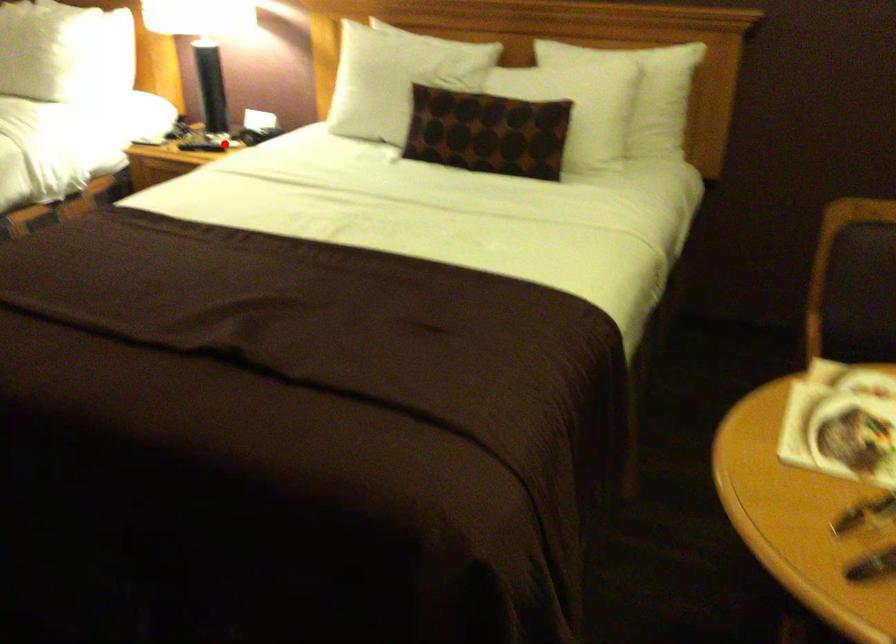
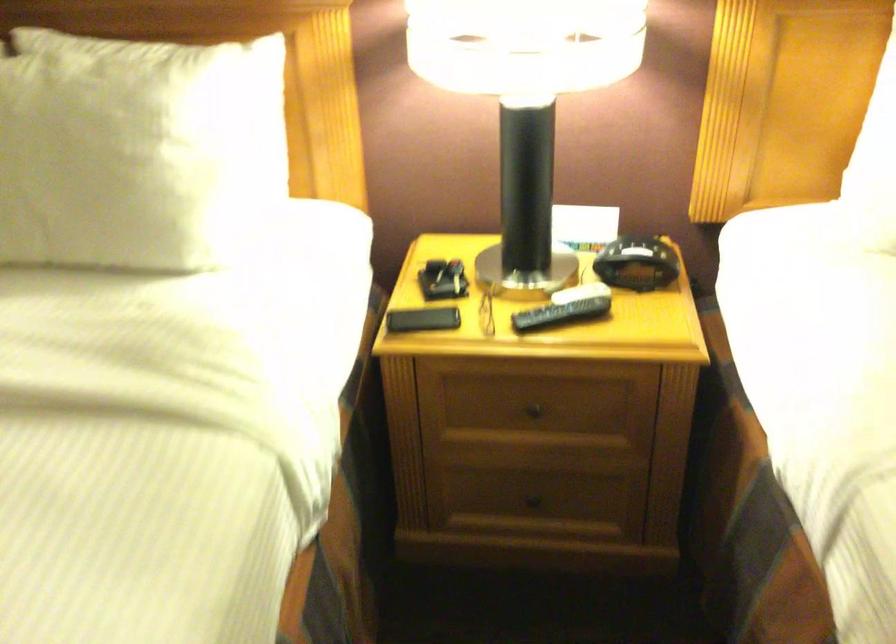
The point at the highlighted location is marked in the first image. Where is the corresponding point in the second image?

(579, 292)